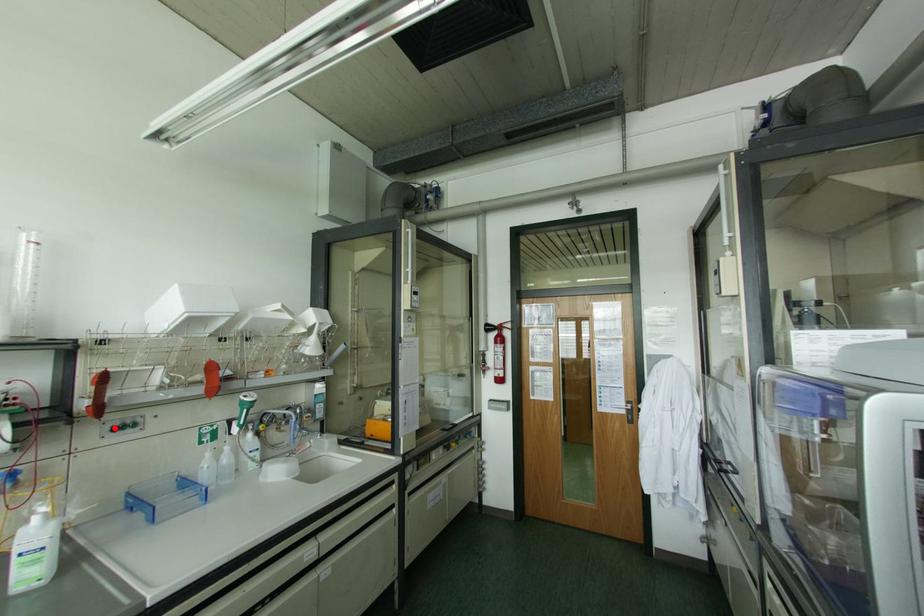
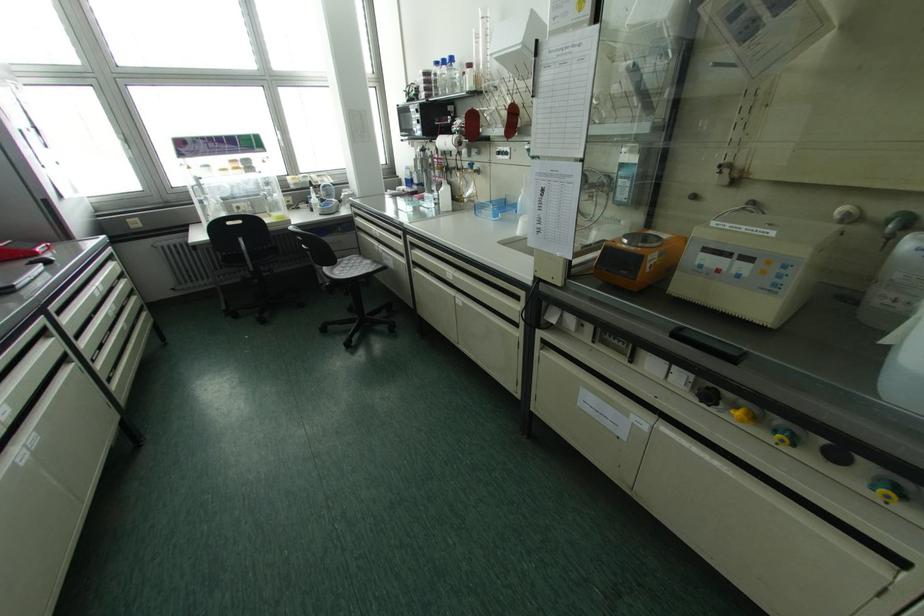
Question: I am providing you with two images of the same scene from different viewpoints. A red point is shown in image1. For the corresponding object point in image2, is it positioned nearer or farther from the camera?

Choices:
 (A) Nearer
 (B) Farther

Answer: (A)